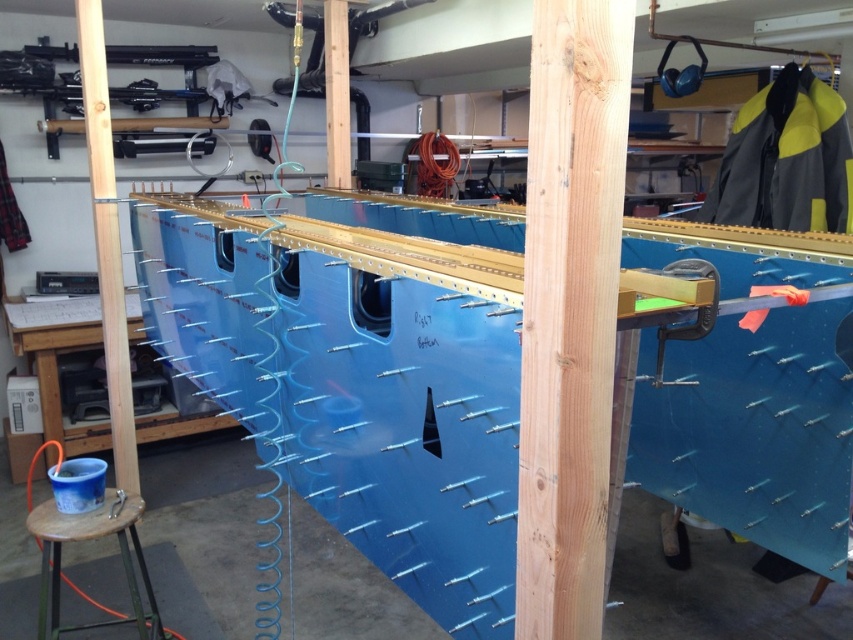
Question: Does wooden beam at center appear under brown wooden stool at lower left?

Choices:
 (A) yes
 (B) no

Answer: (B)

Question: Which object is closer to the camera taking this photo?

Choices:
 (A) wooden beam at center
 (B) blue plastic bucket at lower left
 (C) natural wood beam at center

Answer: (C)

Question: Which point is closer to the camera taking this photo?

Choices:
 (A) (53, 362)
 (B) (51, 608)

Answer: (B)

Question: Is wooden beam at center further to camera compared to brown wooden stool at lower left?

Choices:
 (A) no
 (B) yes

Answer: (B)

Question: Which point appears closest to the camera in this image?

Choices:
 (A) (57, 600)
 (B) (85, 8)
 (C) (96, 442)

Answer: (A)

Question: Can you confirm if natural wood beam at center is positioned above brown wooden stool at lower left?

Choices:
 (A) yes
 (B) no

Answer: (A)